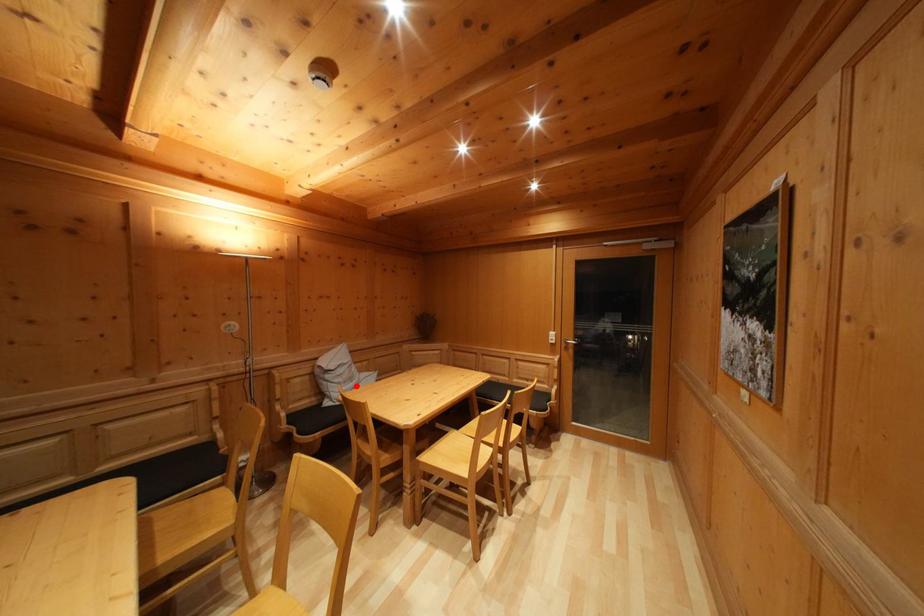
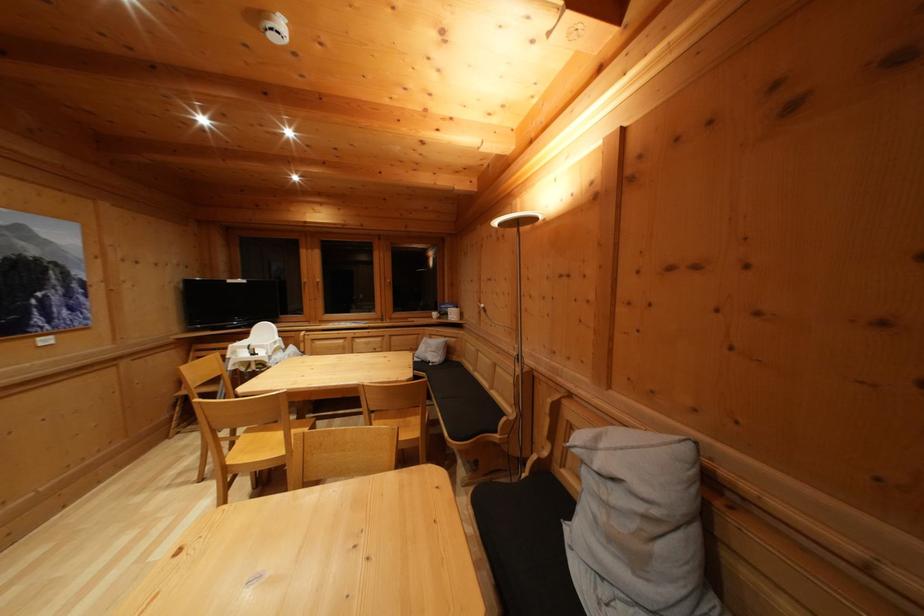
Question: A red point is marked in image1. In image2, is the corresponding 3D point closer to the camera or farther? Reply with the corresponding letter.

Choices:
 (A) The corresponding 3D point is closer.
 (B) The corresponding 3D point is farther.

Answer: (A)